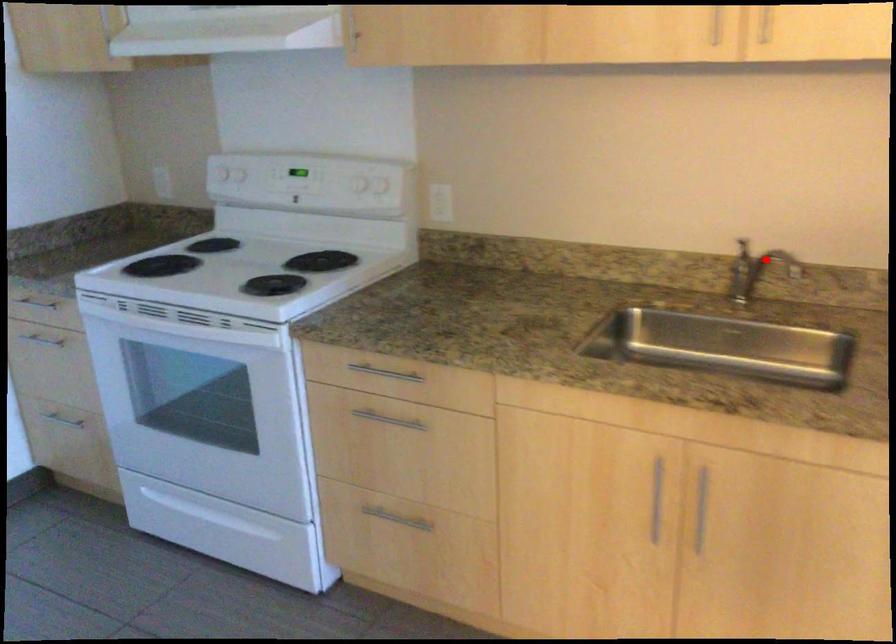
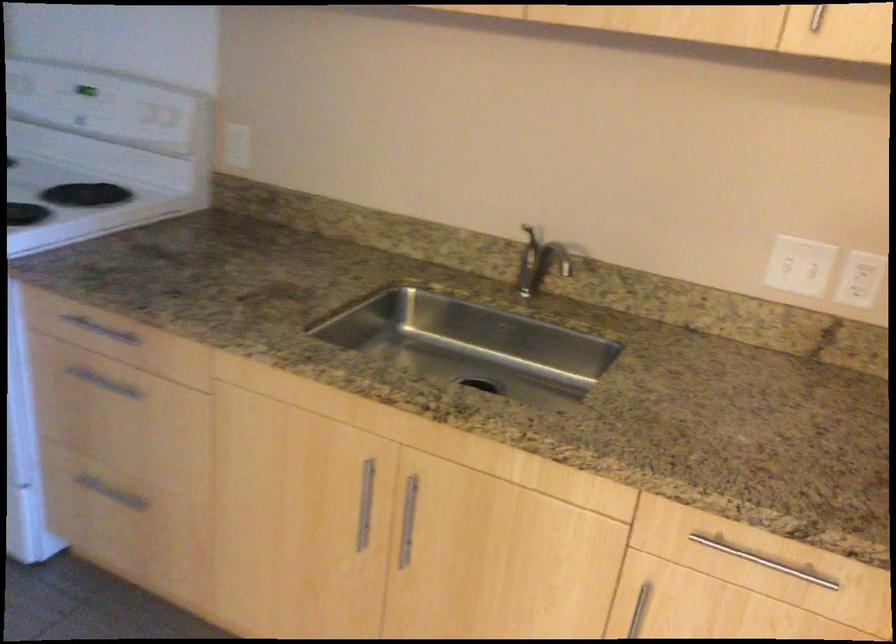
Question: I am providing you with two images of the same scene from different viewpoints. Given a red point in image1, look at the same physical point in image2. Is it:

Choices:
 (A) Closer to the viewpoint
 (B) Farther from the viewpoint

Answer: (A)